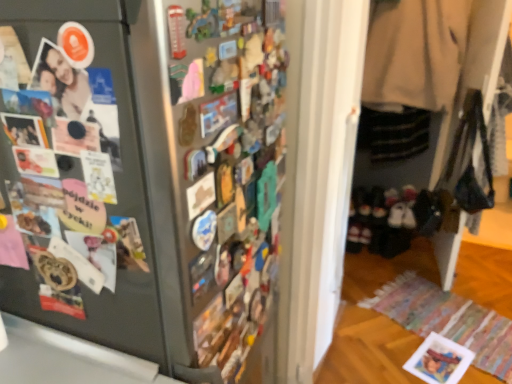
Question: Choose the correct answer: Is matte black photo at left inside beige wool coat at right or outside it?

Choices:
 (A) outside
 (B) inside

Answer: (A)

Question: In terms of width, does matte black photo at left look wider or thinner when compared to beige wool coat at right?

Choices:
 (A) wide
 (B) thin

Answer: (B)

Question: Estimate the real-world distances between objects in this image. Which object is farther from the beige wool coat at right?

Choices:
 (A) matte black photo at left
 (B) satin black fridge at left
 (C) black suede shoes at lower right

Answer: (A)

Question: Which is nearer to the matte black photo at left?

Choices:
 (A) satin black fridge at left
 (B) beige wool coat at right
 (C) black suede shoes at lower right

Answer: (A)